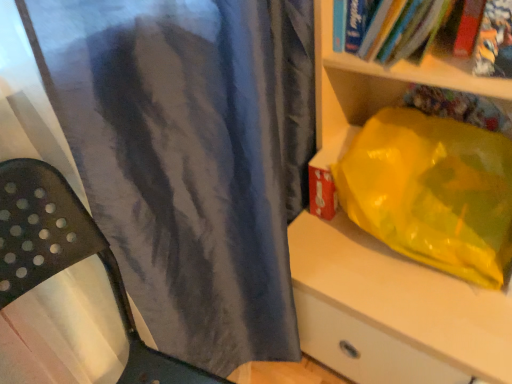
You are a GUI agent. You are given a task and a screenshot of the screen. Output one action in this format:
    pyautogui.click(x=<x>, y=<y>)
    Task: Click on the matte plastic bag at right
    This screenshot has height=384, width=512.
    Given the screenshot: What is the action you would take?
    pyautogui.click(x=392, y=311)

This screenshot has width=512, height=384. In order to click on hardcover book at upper right, positioned as the 2th book in right-to-left order in this screenshot , I will do click(x=493, y=41).

From the image's perspective, does hardcover book at upper right, the first book viewed from the left, appear higher than matte gray curtain at center?

Yes, from the image's perspective, hardcover book at upper right, the first book viewed from the left, is on top of matte gray curtain at center.

Is hardcover book at upper right, positioned as the 2th book in right-to-left order, oriented towards matte gray curtain at center?

Yes, hardcover book at upper right, positioned as the 2th book in right-to-left order, is facing matte gray curtain at center.

Is point (497, 28) behind point (283, 114)?

No, (497, 28) is in front of (283, 114).

How distant is matte plastic bag at right from matte gray curtain at center?

A distance of 8.59 inches exists between matte plastic bag at right and matte gray curtain at center.

Choose the correct answer: Is matte plastic bag at right inside matte gray curtain at center or outside it?

matte plastic bag at right exists outside the volume of matte gray curtain at center.

Which of these two, matte plastic bag at right or matte gray curtain at center, is wider?

matte plastic bag at right is wider.

From the image's perspective, which object appears higher, matte plastic bag at right or matte gray curtain at center?

matte plastic bag at right.

Is hardcover book at upper right, positioned as the 2th book in right-to-left order, located outside hardcover book at upper right, the 2th book in the left-to-right sequence?

Yes.

Is hardcover book at upper right, the first book viewed from the left, bigger or smaller than hardcover book at upper right, which is the first book in right-to-left order?

Considering their sizes, hardcover book at upper right, the first book viewed from the left, takes up more space than hardcover book at upper right, which is the first book in right-to-left order.

Does hardcover book at upper right, the first book viewed from the left, have a greater height compared to hardcover book at upper right, the 2th book in the left-to-right sequence?

Incorrect, the height of hardcover book at upper right, the first book viewed from the left, is not larger of that of hardcover book at upper right, the 2th book in the left-to-right sequence.

Is the position of hardcover book at upper right, positioned as the 2th book in right-to-left order, more distant than that of hardcover book at upper right, the 2th book in the left-to-right sequence?

No, it is in front of hardcover book at upper right, the 2th book in the left-to-right sequence.

At what (x,y) coordinates should I click in order to perform the action: click on book above the hardcover book at upper right, which is the first book in right-to-left order (from the image's perspective). Please return your answer as a coordinate pair (x, y). Looking at the image, I should click on (493, 41).

Consider the image. Considering the sizes of objects hardcover book at upper right, which is the first book in right-to-left order, and hardcover book at upper right, positioned as the 2th book in right-to-left order, in the image provided, who is shorter, hardcover book at upper right, which is the first book in right-to-left order, or hardcover book at upper right, positioned as the 2th book in right-to-left order,?

hardcover book at upper right, positioned as the 2th book in right-to-left order, is shorter.

How different are the orientations of hardcover book at upper right, which is the first book in right-to-left order, and hardcover book at upper right, positioned as the 2th book in right-to-left order, in degrees?

The angle between the facing direction of hardcover book at upper right, which is the first book in right-to-left order, and the facing direction of hardcover book at upper right, positioned as the 2th book in right-to-left order, is 14.9 degrees.

Is hardcover book at upper right, the 2th book in the left-to-right sequence, oriented away from hardcover book at upper right, the first book viewed from the left?

Yes, hardcover book at upper right, the first book viewed from the left, is at the back of hardcover book at upper right, the 2th book in the left-to-right sequence.

Is the surface of matte gray curtain at center in direct contact with hardcover book at upper right, the first book viewed from the left?

No, matte gray curtain at center is not next to hardcover book at upper right, the first book viewed from the left.

From the matte gray curtain at center, count 1st books backward and point to it. Please provide its 2D coordinates.

[(493, 41)]

Considering the sizes of matte gray curtain at center and hardcover book at upper right, positioned as the 2th book in right-to-left order, in the image, is matte gray curtain at center bigger or smaller than hardcover book at upper right, positioned as the 2th book in right-to-left order,?

matte gray curtain at center is bigger than hardcover book at upper right, positioned as the 2th book in right-to-left order.

Is there a large distance between hardcover book at upper right, positioned as the 2th book in right-to-left order, and matte plastic bag at right?

No, hardcover book at upper right, positioned as the 2th book in right-to-left order, is in close proximity to matte plastic bag at right.

Between hardcover book at upper right, the first book viewed from the left, and matte plastic bag at right, which one has more height?

With more height is matte plastic bag at right.

From the image's perspective, which one is positioned lower, hardcover book at upper right, positioned as the 2th book in right-to-left order, or matte plastic bag at right?

From the image's view, matte plastic bag at right is below.

Is matte gray curtain at center placed right next to hardcover book at upper right, the 2th book in the left-to-right sequence?

No, matte gray curtain at center is not making contact with hardcover book at upper right, the 2th book in the left-to-right sequence.

Looking at this image, is hardcover book at upper right, the 2th book in the left-to-right sequence, completely or partially inside matte gray curtain at center?

That's incorrect, hardcover book at upper right, the 2th book in the left-to-right sequence, is not inside matte gray curtain at center.

Is point (282, 131) closer to camera compared to point (485, 48)?

No, (282, 131) is behind (485, 48).

Where is `book that is the 1st one when counting rightward from the matte gray curtain at center`? This screenshot has height=384, width=512. book that is the 1st one when counting rightward from the matte gray curtain at center is located at coordinates (493, 41).

Find the location of `curtain on the left of matte plastic bag at right`. curtain on the left of matte plastic bag at right is located at coordinates (190, 157).

Looking at this image, considering their positions, is hardcover book at upper right, positioned as the 2th book in right-to-left order, positioned further to hardcover book at upper right, the 2th book in the left-to-right sequence, than matte gray curtain at center?

matte gray curtain at center.

In the scene shown: When comparing their distances from matte plastic bag at right, does hardcover book at upper right, which is the first book in right-to-left order, or matte gray curtain at center seem closer?

The object closer to matte plastic bag at right is matte gray curtain at center.

Estimate the real-world distances between objects in this image. Which object is further from matte plastic bag at right, hardcover book at upper right, which is the first book in right-to-left order, or hardcover book at upper right, the first book viewed from the left?

The object further to matte plastic bag at right is hardcover book at upper right, which is the first book in right-to-left order.

Estimate the real-world distances between objects in this image. Which object is closer to hardcover book at upper right, positioned as the 2th book in right-to-left order, matte gray curtain at center or matte plastic bag at right?

matte plastic bag at right lies closer to hardcover book at upper right, positioned as the 2th book in right-to-left order, than the other object.

In the scene shown: Considering their positions, is hardcover book at upper right, the first book viewed from the left, positioned closer to matte gray curtain at center than hardcover book at upper right, which is the first book in right-to-left order?

hardcover book at upper right, the first book viewed from the left.

Looking at the image, which one is located further to hardcover book at upper right, the 2th book in the left-to-right sequence, hardcover book at upper right, the first book viewed from the left, or matte plastic bag at right?

matte plastic bag at right is further to hardcover book at upper right, the 2th book in the left-to-right sequence.

Based on their spatial positions, is hardcover book at upper right, which is the first book in right-to-left order, or matte plastic bag at right closer to hardcover book at upper right, the first book viewed from the left?

hardcover book at upper right, which is the first book in right-to-left order, lies closer to hardcover book at upper right, the first book viewed from the left, than the other object.

From the picture: Based on their spatial positions, is matte plastic bag at right or matte gray curtain at center further from hardcover book at upper right, which is the first book in right-to-left order?

Result: matte gray curtain at center.

This screenshot has width=512, height=384. In order to click on book between hardcover book at upper right, positioned as the 2th book in right-to-left order, and matte gray curtain at center vertically in this screenshot , I will do `click(494, 41)`.

Locate an element on the screen. book that lies between hardcover book at upper right, positioned as the 2th book in right-to-left order, and matte plastic bag at right from top to bottom is located at coordinates (494, 41).

The image size is (512, 384). What are the coordinates of `shelf between hardcover book at upper right, positioned as the 2th book in right-to-left order, and matte gray curtain at center vertically` in the screenshot? It's located at coord(392,311).

Identify the location of shelf between hardcover book at upper right, the 2th book in the left-to-right sequence, and matte gray curtain at center, in the vertical direction. (392, 311).